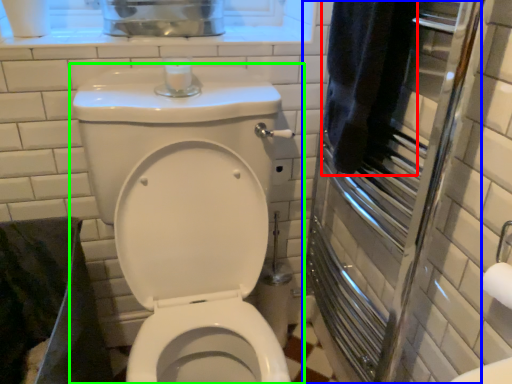
Question: Which is nearer to the bath towel (highlighted by a red box)? screen door (highlighted by a blue box) or toilet (highlighted by a green box).

Choices:
 (A) screen door
 (B) toilet

Answer: (A)